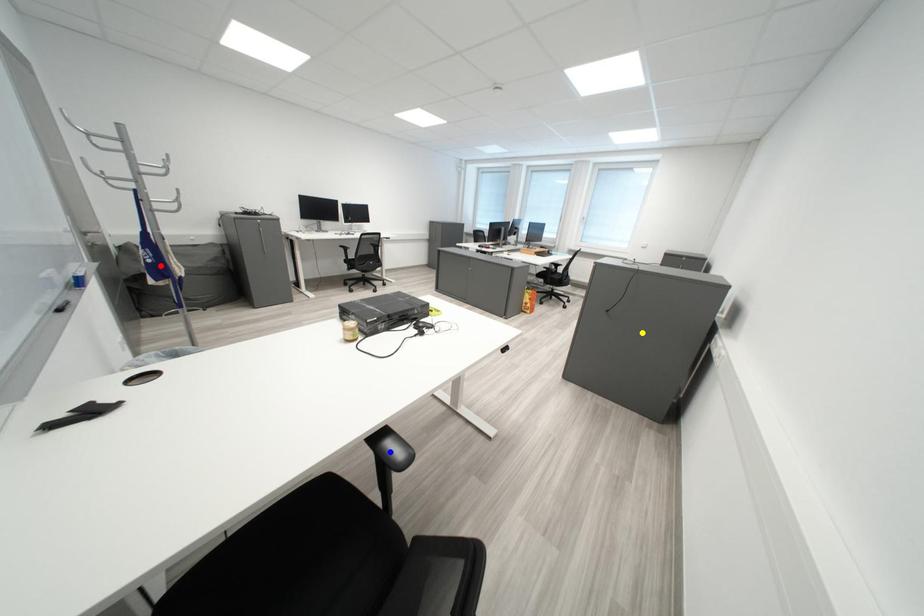
Order these from nearest to farthest:
red point
yellow point
blue point

blue point → red point → yellow point